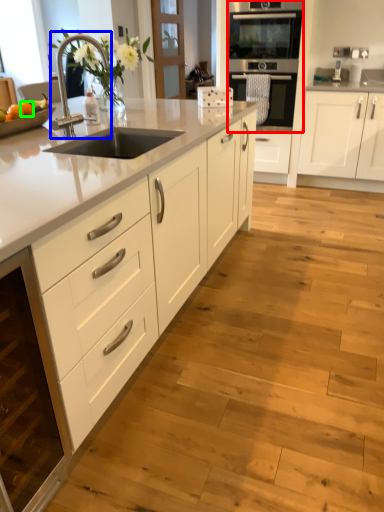
Question: Based on their relative distances, which object is farther from oven (highlighted by a red box)? Choose from faucet (highlighted by a blue box) and orange (highlighted by a green box).

Choices:
 (A) faucet
 (B) orange

Answer: (B)